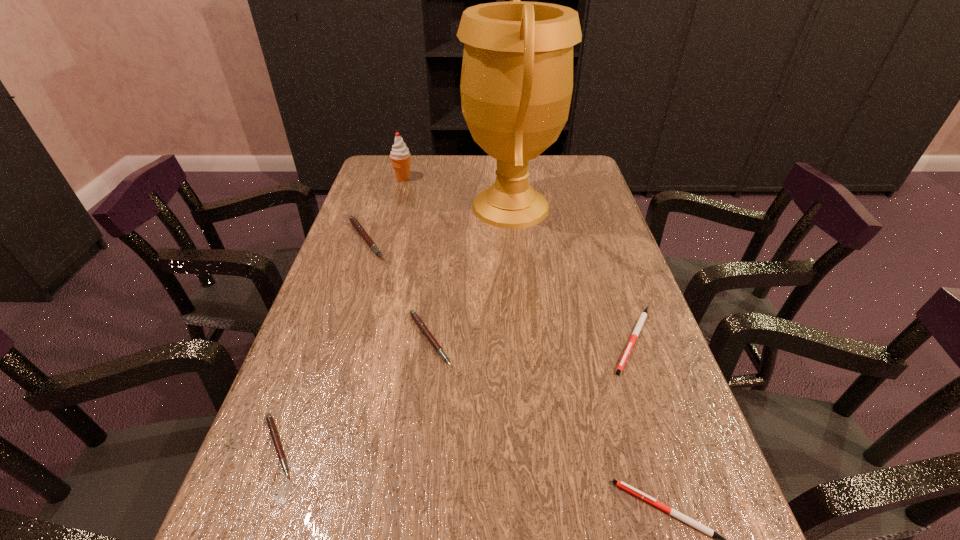
Find the location of `trophy`. trophy is located at coordinates (516, 86).

Find the location of a particular element. the sixth shortest object is located at coordinates (400, 156).

Locate an element on the screen. The image size is (960, 540). red icecream is located at coordinates (400, 156).

This screenshot has height=540, width=960. In order to click on the third tallest object in this screenshot , I will do `click(353, 220)`.

The image size is (960, 540). In order to click on the biggest pink pen in this screenshot , I will do `click(353, 220)`.

What are the coordinates of `the second smallest pink pen` in the screenshot? It's located at (413, 314).

Where is `the rightmost pink pen`? The width and height of the screenshot is (960, 540). the rightmost pink pen is located at coordinates (413, 314).

What are the coordinates of `the farther white pen` in the screenshot? It's located at (637, 329).

Locate an element on the screen. The width and height of the screenshot is (960, 540). the nearest pink pen is located at coordinates (271, 425).

Find the location of a particular element. Image resolution: width=960 pixels, height=540 pixels. the fourth farthest pen is located at coordinates (271, 425).